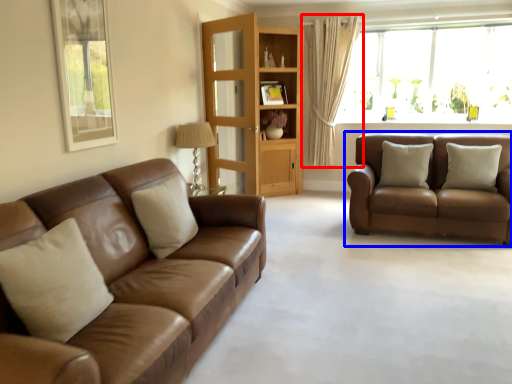
Question: Which object is closer to the camera taking this photo, curtain (highlighted by a red box) or studio couch (highlighted by a blue box)?

Choices:
 (A) curtain
 (B) studio couch

Answer: (B)